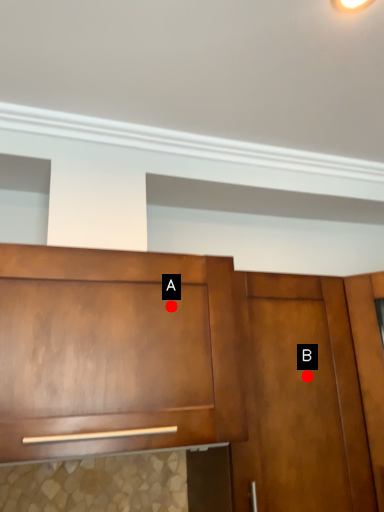
Question: Two points are circled on the image, labeled by A and B beside each circle. Which point is farther to the camera?

Choices:
 (A) A is further
 (B) B is further

Answer: (B)